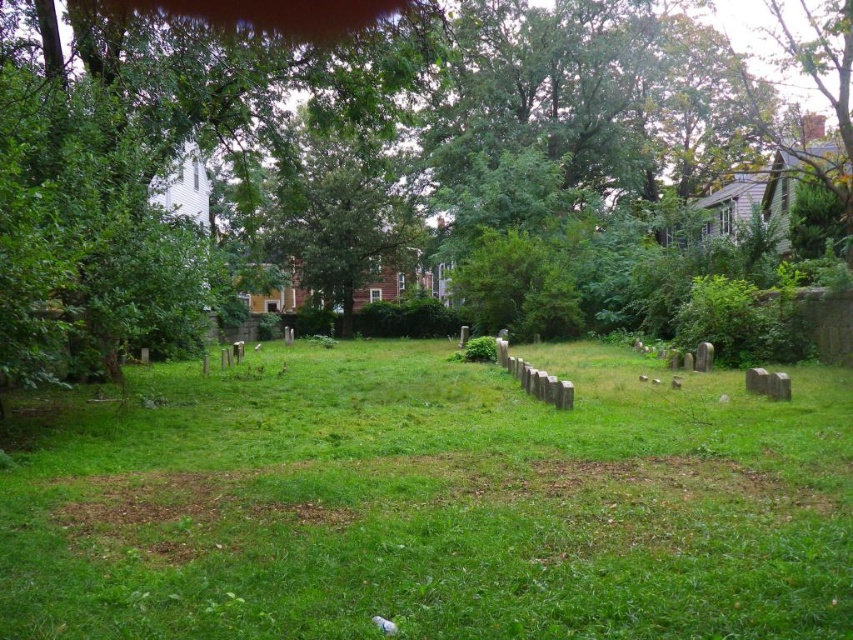
Question: Is green grassy area at center positioned before green leafy tree at center?

Choices:
 (A) no
 (B) yes

Answer: (B)

Question: In this image, where is green grassy area at center located relative to green leafy tree at center?

Choices:
 (A) left
 (B) right

Answer: (A)

Question: Among these objects, which one is nearest to the camera?

Choices:
 (A) green leafy tree at center
 (B) green grassy area at center

Answer: (B)

Question: Is green grassy area at center positioned behind green leafy tree at center?

Choices:
 (A) yes
 (B) no

Answer: (B)

Question: Which point is closer to the camera taking this photo?

Choices:
 (A) (126, 256)
 (B) (22, 524)

Answer: (B)